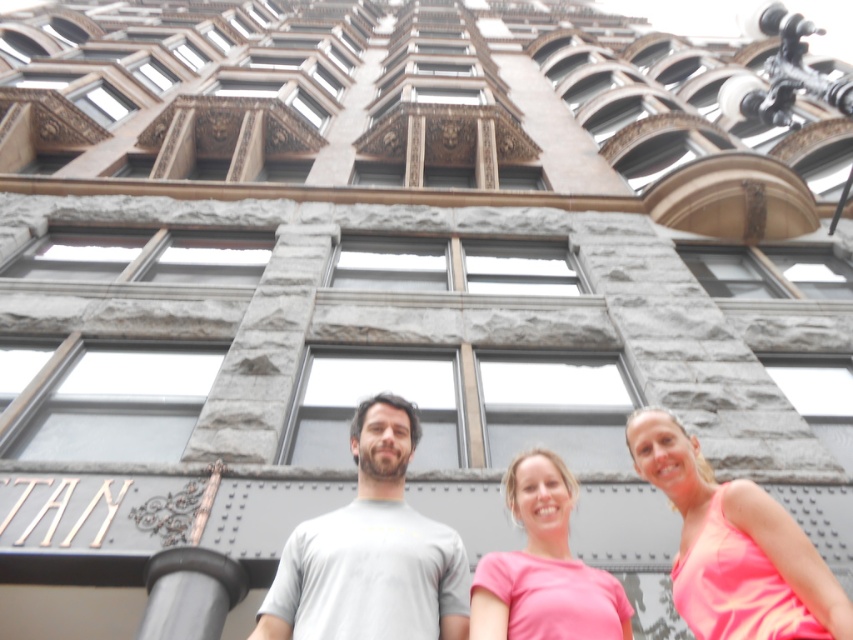
You are a photographer trying to capture the pink matte shirt at center and the black rubber pole at lower center in the same frame. Based on their positions, which object should you focus on first to ensure both are in focus?

The pink matte shirt at center is located above the black rubber pole at lower center, so you should focus on the pink matte shirt at center first to ensure both are in focus.

You are standing at the entrance of the tall ornate building and see the pink matte shirt at center and the black rubber pole at lower center. Which object is positioned to the right side from your perspective?

The pink matte shirt at center is positioned to the right of the black rubber pole at lower center, so the pink matte shirt at center is on the right side.